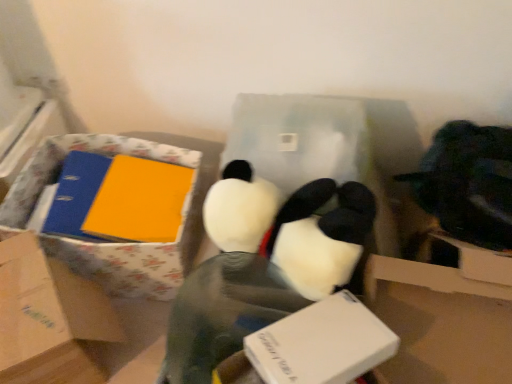
Question: Does floral-patterned cardboard box at left have a lesser height compared to matte cardboard box at left, the 2th box positioned from the right?

Choices:
 (A) yes
 (B) no

Answer: (A)

Question: Does floral-patterned cardboard box at left lie in front of matte cardboard box at left, the 2th box positioned from the right?

Choices:
 (A) yes
 (B) no

Answer: (B)

Question: From the image's perspective, is floral-patterned cardboard box at left over matte cardboard box at left, the 2th box positioned from the right?

Choices:
 (A) yes
 (B) no

Answer: (A)

Question: Is floral-patterned cardboard box at left not close to matte cardboard box at left, the 1th box from the left?

Choices:
 (A) yes
 (B) no

Answer: (B)

Question: Can you confirm if floral-patterned cardboard box at left is smaller than matte cardboard box at left, the 2th box positioned from the right?

Choices:
 (A) no
 (B) yes

Answer: (A)

Question: Based on their sizes in the image, would you say blue matte binder at left is bigger or smaller than matte cardboard box at left, the 1th box from the left?

Choices:
 (A) big
 (B) small

Answer: (B)

Question: Does point (102, 178) appear closer or farther from the camera than point (32, 274)?

Choices:
 (A) closer
 (B) farther

Answer: (B)

Question: From a real-world perspective, relative to matte cardboard box at left, the 1th box from the left, is blue matte binder at left vertically above or below?

Choices:
 (A) below
 (B) above

Answer: (B)

Question: Is blue matte binder at left wider or thinner than matte cardboard box at left, the 2th box positioned from the right?

Choices:
 (A) thin
 (B) wide

Answer: (A)

Question: From the image's perspective, relative to matte cardboard box at left, the 1th box from the left, is white plush toy at center above or below?

Choices:
 (A) below
 (B) above

Answer: (B)

Question: Is white plush toy at center in front of or behind matte cardboard box at left, the 2th box positioned from the right, in the image?

Choices:
 (A) behind
 (B) front

Answer: (B)

Question: Does point (230, 334) appear closer or farther from the camera than point (76, 279)?

Choices:
 (A) closer
 (B) farther

Answer: (A)

Question: Considering the positions of white plush toy at center and matte cardboard box at left, the 1th box from the left, in the image, is white plush toy at center wider or thinner than matte cardboard box at left, the 1th box from the left,?

Choices:
 (A) thin
 (B) wide

Answer: (A)

Question: From a real-world perspective, is white plush toy at center above or below floral-patterned cardboard box at left?

Choices:
 (A) below
 (B) above

Answer: (B)

Question: Considering the positions of white plush toy at center and floral-patterned cardboard box at left in the image, is white plush toy at center wider or thinner than floral-patterned cardboard box at left?

Choices:
 (A) wide
 (B) thin

Answer: (B)